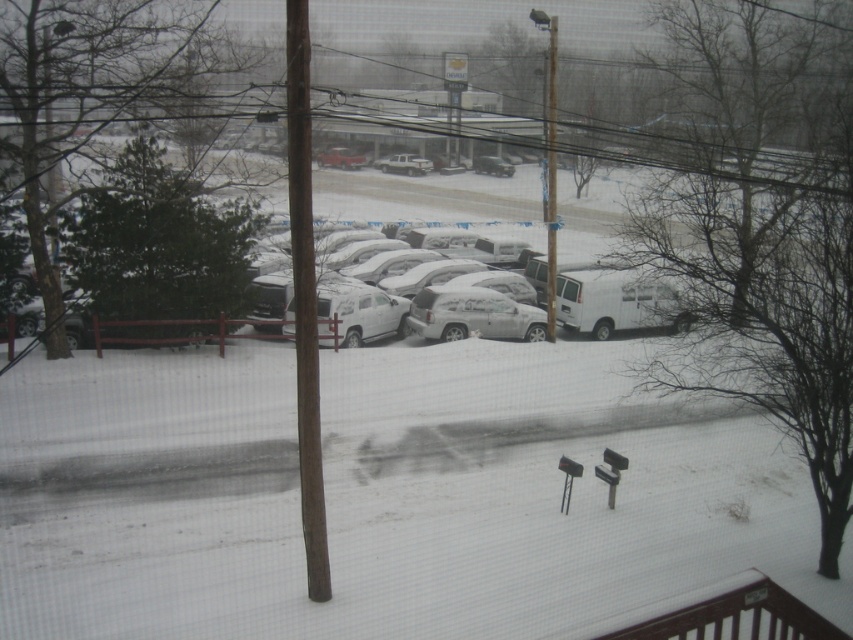
In the scene shown: You are standing on the balcony and want to locate the metallic pole at center. According to the coordinates provided, where would you look relative to the center of the image?

The metallic pole at center is located at coordinates 0.259 on the x axis and 0.646 on the y axis. Since the center of the image is at 0.5 on both axes, this means the metallic pole at center is to the left and below the center point of the image.

You are standing on the balcony and want to determine which object is taller between the metallic pole at center and the white matte van at center. Based on the snowy scene described, which one is taller?

The metallic pole at center is taller than the white matte van at center.